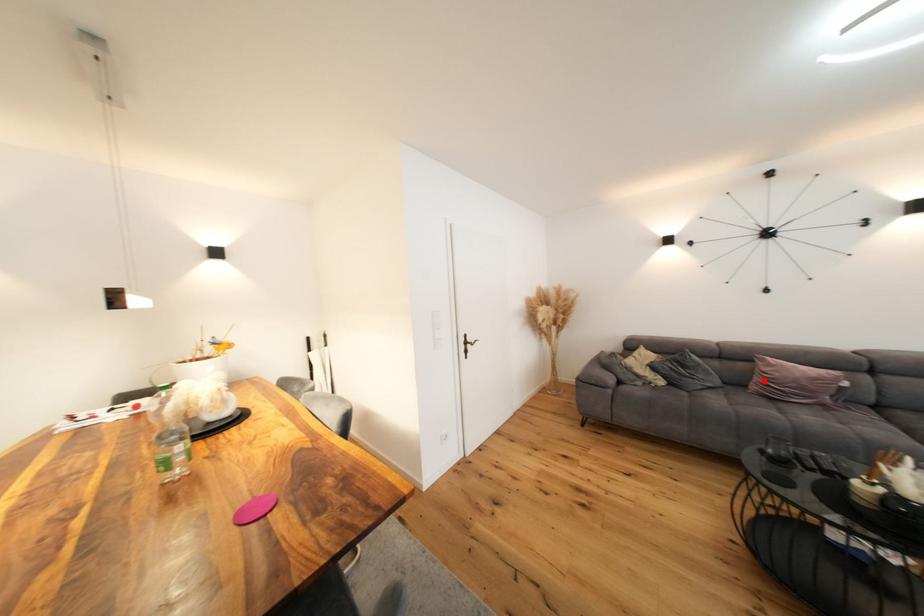
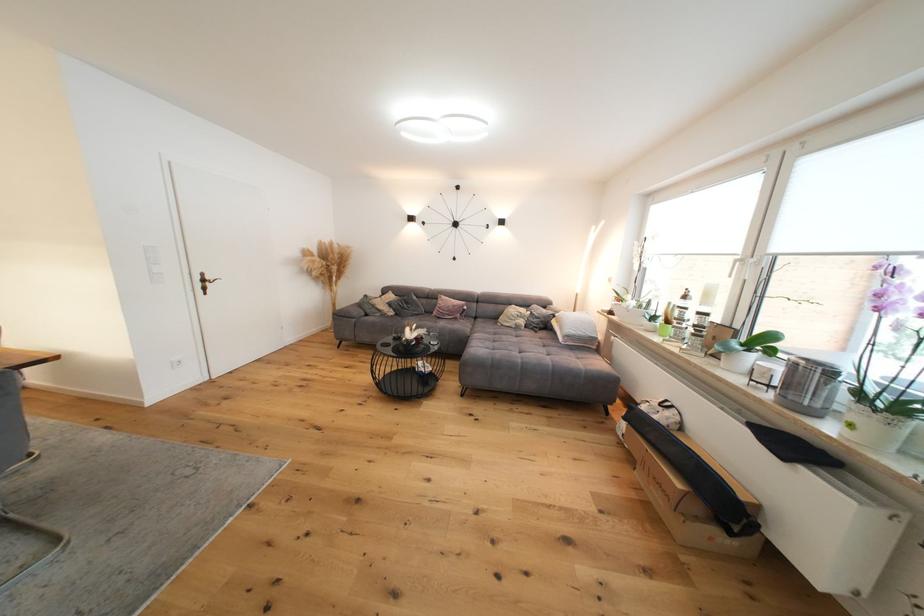
In the second image, find the point that corresponds to the highlighted location in the first image.

(444, 310)